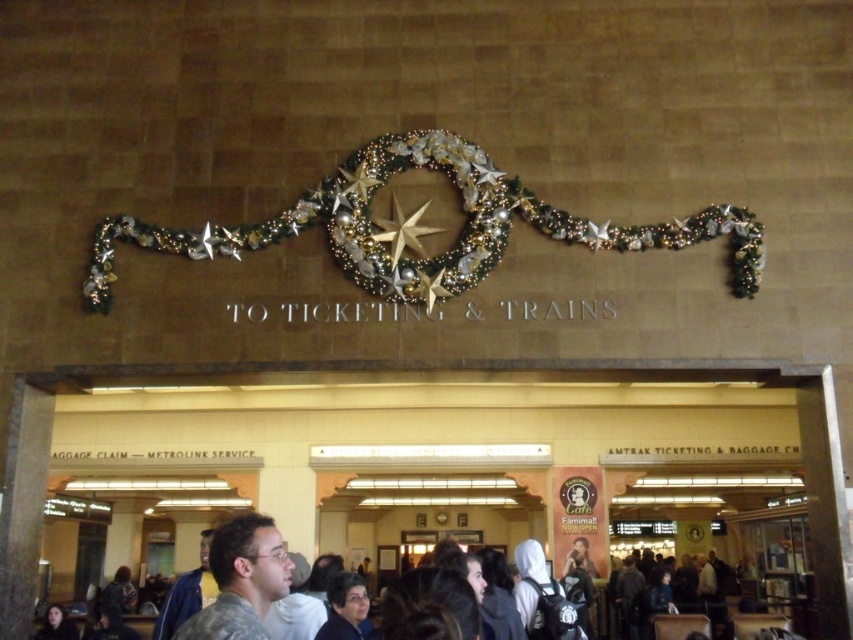
Question: Is the position of camouflage fabric shirt at center more distant than that of gold metallic star at center?

Choices:
 (A) no
 (B) yes

Answer: (A)

Question: Which point is closer to the camera?

Choices:
 (A) gold metallic star at center
 (B) camouflage jacket at lower center

Answer: (B)

Question: Can you confirm if camouflage fabric shirt at center is positioned below gold metallic star at center?

Choices:
 (A) yes
 (B) no

Answer: (A)

Question: Which object is farther from the camera taking this photo?

Choices:
 (A) camouflage fabric shirt at center
 (B) camouflage jacket at lower center

Answer: (A)

Question: Which point is farther from the camera taking this photo?

Choices:
 (A) pyautogui.click(x=253, y=612)
 (B) pyautogui.click(x=427, y=204)
 (C) pyautogui.click(x=657, y=564)

Answer: (C)

Question: Does camouflage fabric shirt at center appear on the right side of camouflage jacket at lower center?

Choices:
 (A) yes
 (B) no

Answer: (B)